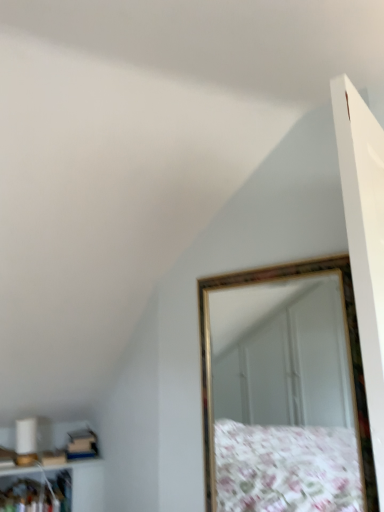
Question: Considering the relative positions of white glossy cabinet at lower left and gold-framed mirror at upper right in the image provided, is white glossy cabinet at lower left to the left or to the right of gold-framed mirror at upper right?

Choices:
 (A) left
 (B) right

Answer: (A)

Question: Considering the positions of white glossy cabinet at lower left and gold-framed mirror at upper right in the image, is white glossy cabinet at lower left wider or thinner than gold-framed mirror at upper right?

Choices:
 (A) thin
 (B) wide

Answer: (B)

Question: In terms of height, does white glossy cabinet at lower left look taller or shorter compared to gold-framed mirror at upper right?

Choices:
 (A) tall
 (B) short

Answer: (B)

Question: From the image's perspective, is gold-framed mirror at upper right positioned above or below white glossy cabinet at lower left?

Choices:
 (A) above
 (B) below

Answer: (A)

Question: Is gold-framed mirror at upper right to the left or to the right of white glossy cabinet at lower left in the image?

Choices:
 (A) right
 (B) left

Answer: (A)

Question: From a real-world perspective, is gold-framed mirror at upper right above or below white glossy cabinet at lower left?

Choices:
 (A) above
 (B) below

Answer: (A)

Question: Is point (294, 476) closer or farther from the camera than point (49, 501)?

Choices:
 (A) farther
 (B) closer

Answer: (A)